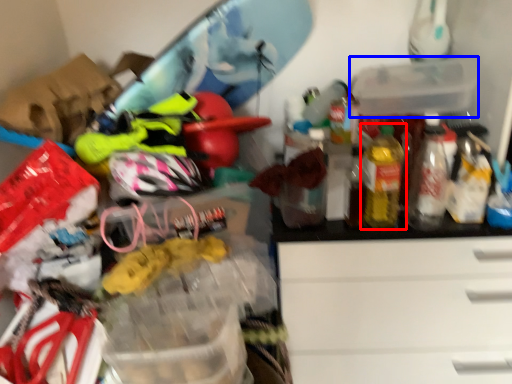
Question: Which of the following is the closest to the observer, bottle (highlighted by a red box) or storage box (highlighted by a blue box)?

Choices:
 (A) bottle
 (B) storage box

Answer: (A)